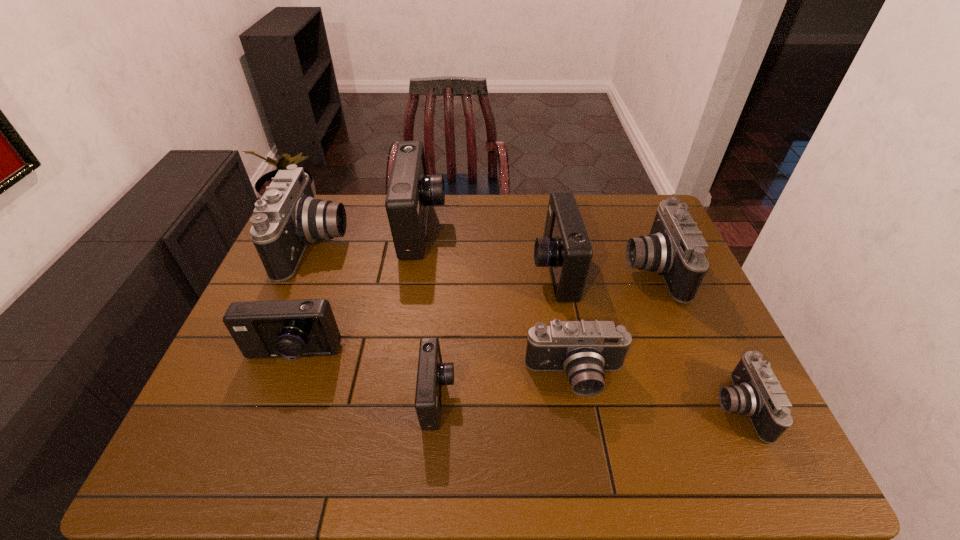
You are a GUI agent. You are given a task and a screenshot of the screen. Output one action in this format:
    pyautogui.click(x=<x>, y=<y>)
    Task: Click on the camera that stands as the closest to the biggest blue camera
    
    Given the screenshot: What is the action you would take?
    287,218

Image resolution: width=960 pixels, height=540 pixels. In order to click on camera that stands as the third closest to the third smallest black camera in this screenshot , I will do `click(757, 393)`.

Identify which blue camera is the third nearest to the smallest black camera. Please provide its 2D coordinates. Your answer should be formatted as a tuple, i.e. [(x, y)], where the tuple contains the x and y coordinates of a point satisfying the conditions above.

[(411, 191)]

Identify the location of blue camera identified as the second closest to the second smallest blue camera. (411, 191).

Identify which black camera is the third closest to the smallest black camera. Please provide its 2D coordinates. Your answer should be formatted as a tuple, i.e. [(x, y)], where the tuple contains the x and y coordinates of a point satisfying the conditions above.

[(287, 218)]

At what (x,y) coordinates should I click in order to perform the action: click on black camera that is the second nearest to the smallest blue camera. Please return your answer as a coordinate pair (x, y). The height and width of the screenshot is (540, 960). Looking at the image, I should click on (287, 218).